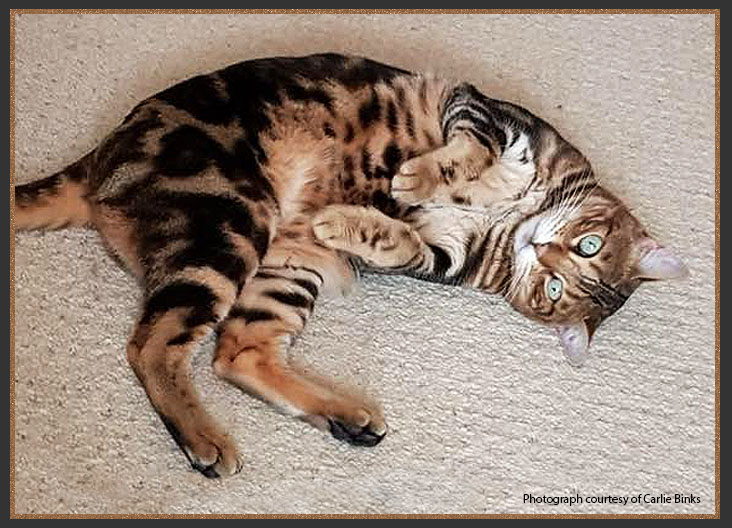
At what (x,y) coordinates should I click in order to perform the action: click on carpet. Please return your answer as a coordinate pair (x, y). The width and height of the screenshot is (732, 528). Looking at the image, I should click on (490, 428).